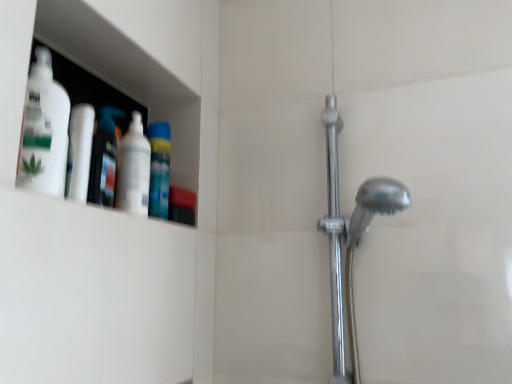
Question: Is white glossy bottle at upper left, marked as the third cleaning product in a front-to-back arrangement, positioned in front of blue matte mouthwash at upper left, the second mouthwash positioned from the left?

Choices:
 (A) yes
 (B) no

Answer: (A)

Question: Does white glossy bottle at upper left, arranged as the 1th cleaning product when viewed from the back, turn towards blue matte mouthwash at upper left, the second mouthwash positioned from the left?

Choices:
 (A) no
 (B) yes

Answer: (A)

Question: Does white glossy bottle at upper left, marked as the third cleaning product in a front-to-back arrangement, appear on the left side of blue matte mouthwash at upper left, acting as the 1th mouthwash starting from the right?

Choices:
 (A) no
 (B) yes

Answer: (B)

Question: Can blue matte mouthwash at upper left, placed as the 2th mouthwash when sorted from front to back, be found inside white glossy bottle at upper left, arranged as the 1th cleaning product when viewed from the back?

Choices:
 (A) yes
 (B) no

Answer: (B)

Question: From a real-world perspective, is white glossy bottle at upper left, arranged as the 1th cleaning product when viewed from the back, located higher than blue matte mouthwash at upper left, the first mouthwash from the back?

Choices:
 (A) no
 (B) yes

Answer: (A)

Question: Is point (51, 160) positioned closer to the camera than point (122, 157)?

Choices:
 (A) closer
 (B) farther

Answer: (A)

Question: In terms of size, does white matte bottle at upper left, the 3th cleaning product when ordered from back to front, appear bigger or smaller than white glossy bottle at upper left, arranged as the 1th cleaning product when viewed from the back?

Choices:
 (A) small
 (B) big

Answer: (B)

Question: Relative to white glossy bottle at upper left, arranged as the 1th cleaning product when viewed from the back, is white matte bottle at upper left, the 3th cleaning product when ordered from back to front, in front or behind?

Choices:
 (A) front
 (B) behind

Answer: (A)

Question: Which is correct: white matte bottle at upper left, the 3th cleaning product when ordered from back to front, is inside white glossy bottle at upper left, marked as the third cleaning product in a front-to-back arrangement, or outside of it?

Choices:
 (A) outside
 (B) inside

Answer: (A)

Question: From their relative heights in the image, would you say polished chrome shower door at right is taller or shorter than white glossy bottle at left, marked as the 1th mouthwash in a front-to-back arrangement?

Choices:
 (A) short
 (B) tall

Answer: (B)

Question: From a real-world perspective, is polished chrome shower door at right physically located above or below white glossy bottle at left, acting as the 2th mouthwash starting from the back?

Choices:
 (A) above
 (B) below

Answer: (B)

Question: Would you say polished chrome shower door at right is inside or outside white glossy bottle at left, marked as the 2th mouthwash in a right-to-left arrangement?

Choices:
 (A) outside
 (B) inside

Answer: (A)

Question: Is polished chrome shower door at right bigger or smaller than white glossy bottle at left, marked as the 2th mouthwash in a right-to-left arrangement?

Choices:
 (A) big
 (B) small

Answer: (A)

Question: Do you think white glossy bottle at left, acting as the 2th mouthwash starting from the back, is within blue matte mouthwash at upper left, the second mouthwash positioned from the left, or outside of it?

Choices:
 (A) outside
 (B) inside

Answer: (A)

Question: From the image's perspective, is white glossy bottle at left, which ranks as the 1th mouthwash in left-to-right order, positioned above or below blue matte mouthwash at upper left, the second mouthwash positioned from the left?

Choices:
 (A) below
 (B) above

Answer: (B)